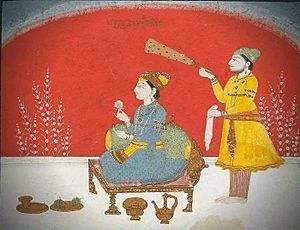
In order to click on chair in this screenshot , I will do `click(179, 187)`.